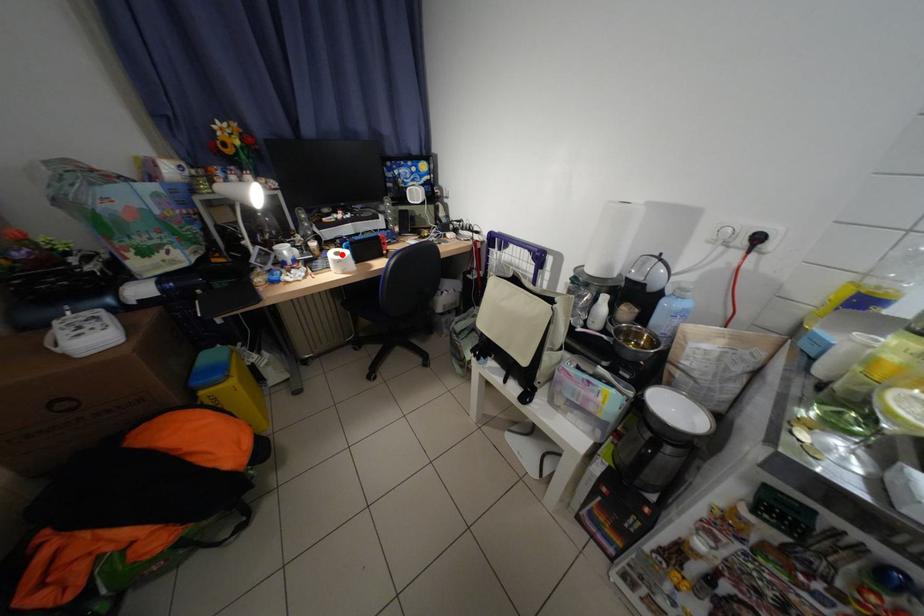
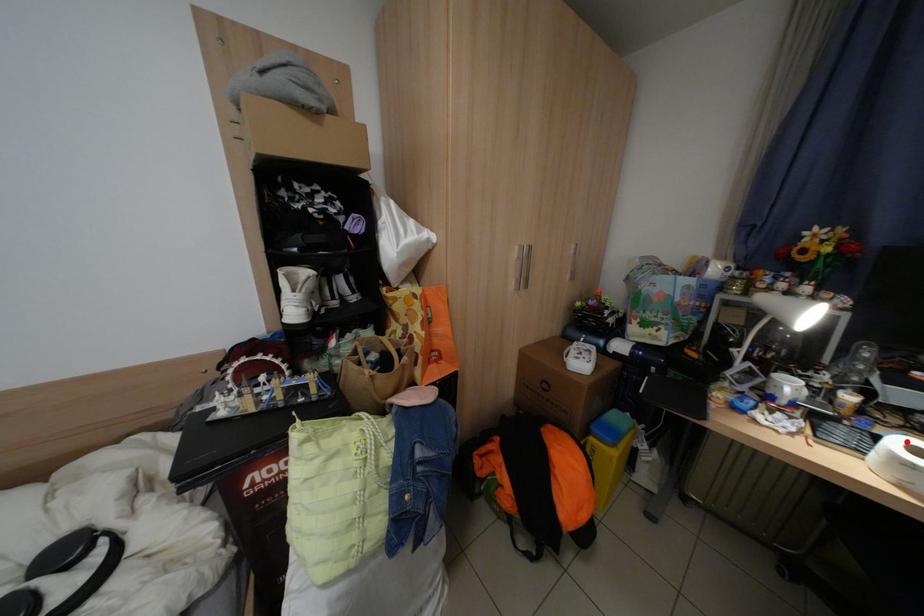
I am providing you with two images of the same scene from different viewpoints. A red point is marked on the first image and another point is marked on the second image. Does the point marked in image1 correspond to the same location as the one in image2?

Yes